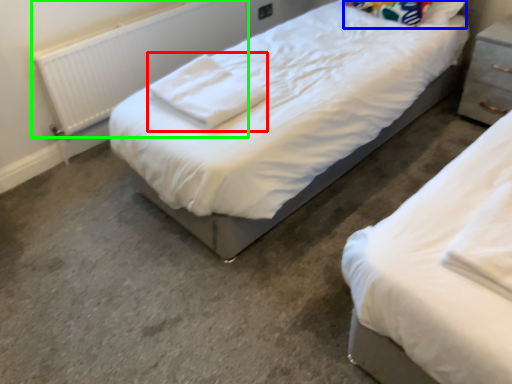
Question: Considering the real-world distances, which object is farthest from cloth (highlighted by a red box)? pillow (highlighted by a blue box) or radiator (highlighted by a green box)?

Choices:
 (A) pillow
 (B) radiator

Answer: (A)